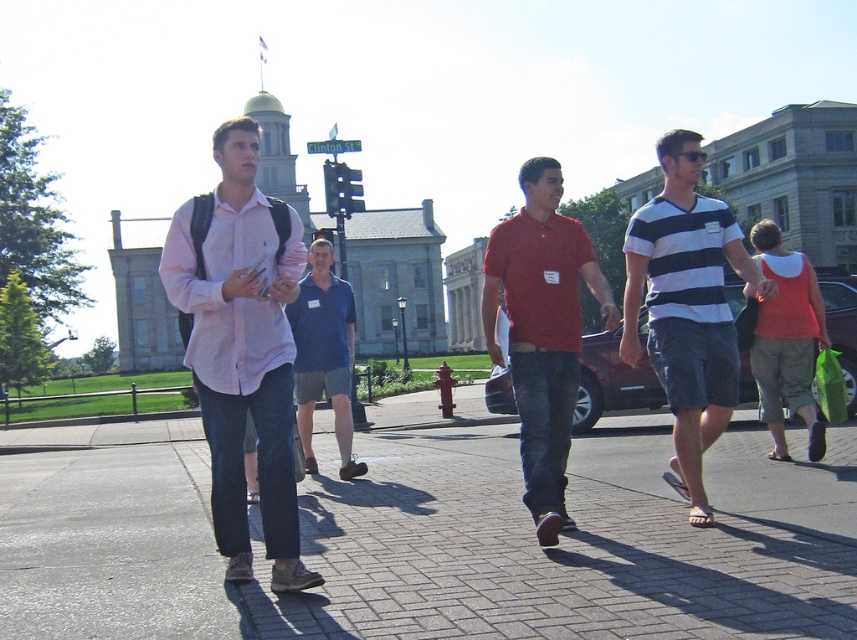
You are a photographer standing at the far right end of the pathway. You want to take a photo of both the pink cotton shirt at center and the striped cotton shirt at center in the same frame. Given that your camera has a maximum focus range of 3 meters, will both subjects be in focus?

The distance between the pink cotton shirt at center and the striped cotton shirt at center is 3.58 meters, which exceeds the camera focus range of 3 meters. Therefore, both subjects cannot be in focus simultaneously.

You are a photographer standing on the pathway and want to take a photo of the two men in the center wearing the pink cotton shirt at center and striped cotton shirt at center. Which one should you focus on first if you want to capture the one closer to the left side?

The pink cotton shirt at center is to the left of the striped cotton shirt at center, so you should focus on the pink cotton shirt at center first to capture the one closer to the left side.

You are a photographer trying to capture a photo of the matte red polo shirt at center and the matte orange tank top at right. Since you want to include both in the frame, which direction should you position your camera relative to the two individuals?

You should position your camera to the left of both the matte red polo shirt at center and the matte orange tank top at right because the matte red polo shirt at center is on the left side of the matte orange tank top at right.